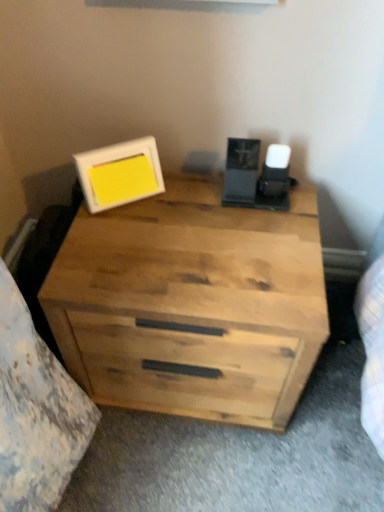
Where is `free location to the right of white matte picture frame at upper left`? The image size is (384, 512). free location to the right of white matte picture frame at upper left is located at coordinates (198, 207).